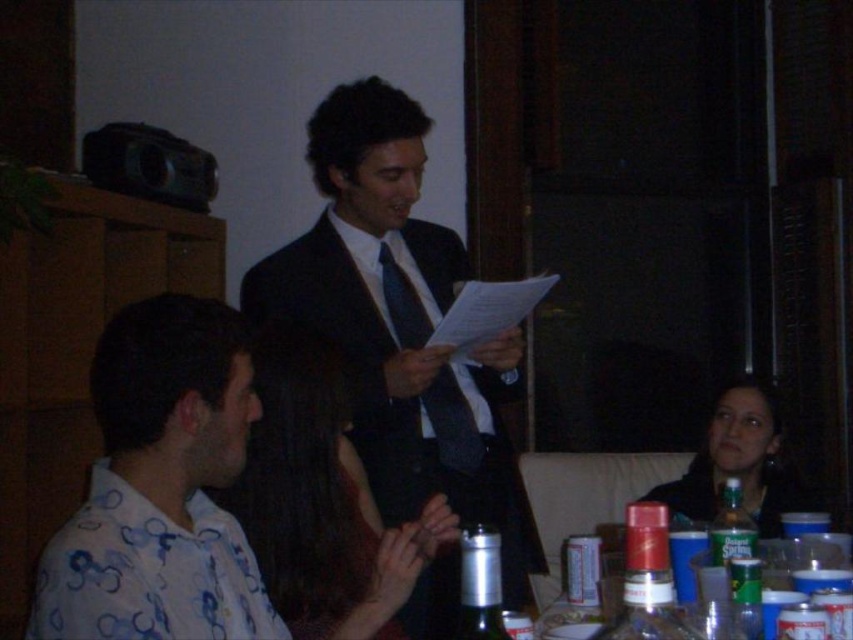
Question: Which object is closer to the camera taking this photo?

Choices:
 (A) matte black tie at center
 (B) matte black suit at center

Answer: (B)

Question: Is white printed shirt at left further to the viewer compared to matte black hair at center?

Choices:
 (A) yes
 (B) no

Answer: (B)

Question: Which of the following is the closest to the observer?

Choices:
 (A) 733,420
 (B) 189,424

Answer: (B)

Question: Does matte black hair at center appear on the left side of metallic silver bottle at center?

Choices:
 (A) no
 (B) yes

Answer: (A)

Question: In this image, where is matte black suit at center located relative to matte black hair at center?

Choices:
 (A) above
 (B) below

Answer: (A)

Question: Which point is farther to the camera?

Choices:
 (A) white printed shirt at left
 (B) matte black tie at center

Answer: (B)